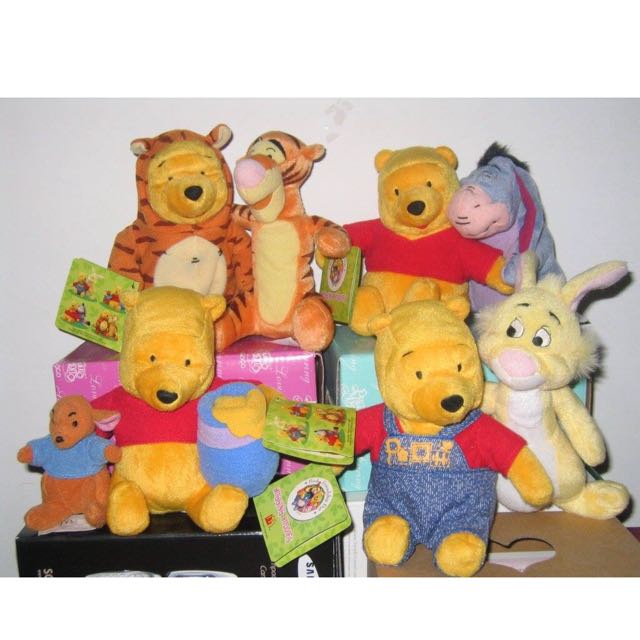
The image size is (640, 640). I want to click on books, so click(x=161, y=328), click(x=356, y=269), click(x=322, y=507), click(x=322, y=422), click(x=93, y=294).